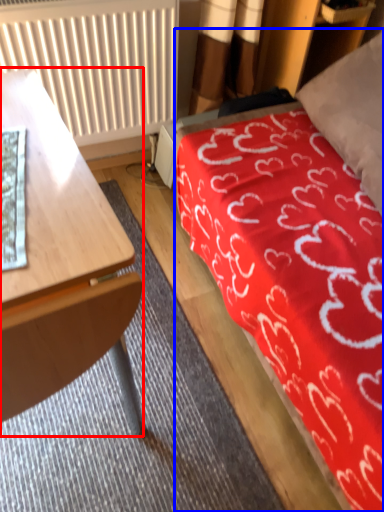
Question: Which object is closer to the camera taking this photo, desk (highlighted by a red box) or bed (highlighted by a blue box)?

Choices:
 (A) desk
 (B) bed

Answer: (A)